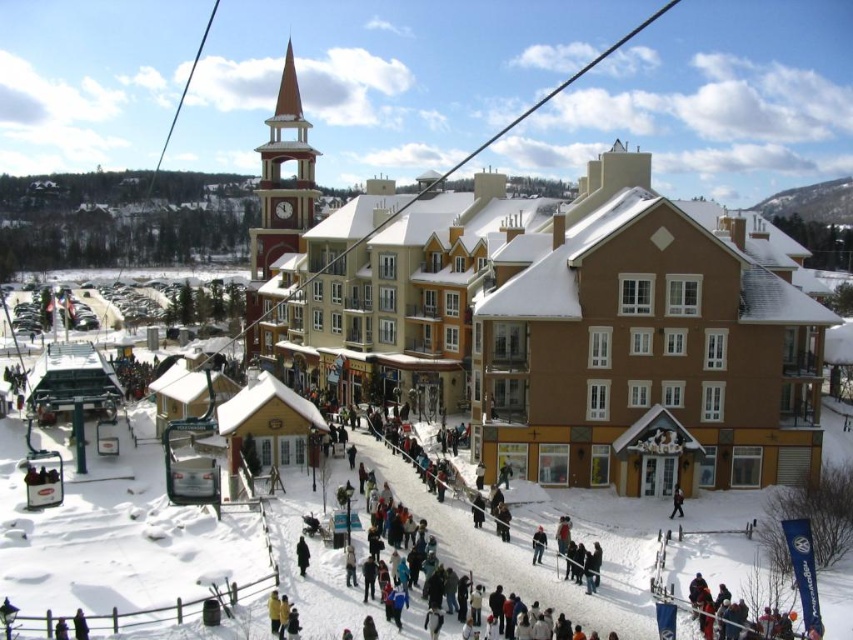
Which is behind, point (775, 371) or point (299, 552)?

The point (775, 371) is behind.

You are a GUI agent. You are given a task and a screenshot of the screen. Output one action in this format:
    pyautogui.click(x=<x>, y=<y>)
    Task: Click on the brown wooden building at center
    
    Given the screenshot: What is the action you would take?
    pyautogui.click(x=570, y=323)

Locate an element on the screen. brown wooden building at center is located at coordinates (570, 323).

From the picture: Between brown wooden building at center and dark gray jacket at center, which one appears on the right side from the viewer's perspective?

dark gray jacket at center is more to the right.

Is the position of brown wooden building at center more distant than that of dark gray jacket at center?

Yes, brown wooden building at center is behind dark gray jacket at center.

Based on the photo, who is more forward, [759,456] or [679,513]?

A: Positioned in front is point [679,513].

I want to click on brown wooden building at center, so click(x=570, y=323).

Is black matte coat at lower center wider than dark gray jacket at center?

No.

Find the location of a particular element. The image size is (853, 640). black matte coat at lower center is located at coordinates [302, 556].

Locate an element on the screen. The width and height of the screenshot is (853, 640). black matte coat at lower center is located at coordinates 302,556.